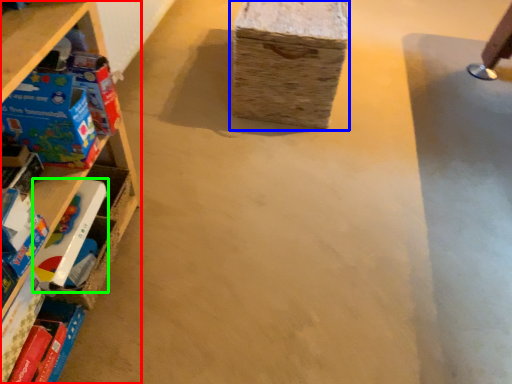
Question: Which is nearer to the shelf (highlighted by a red box)? cardboard box (highlighted by a blue box) or toy (highlighted by a green box).

Choices:
 (A) cardboard box
 (B) toy

Answer: (B)